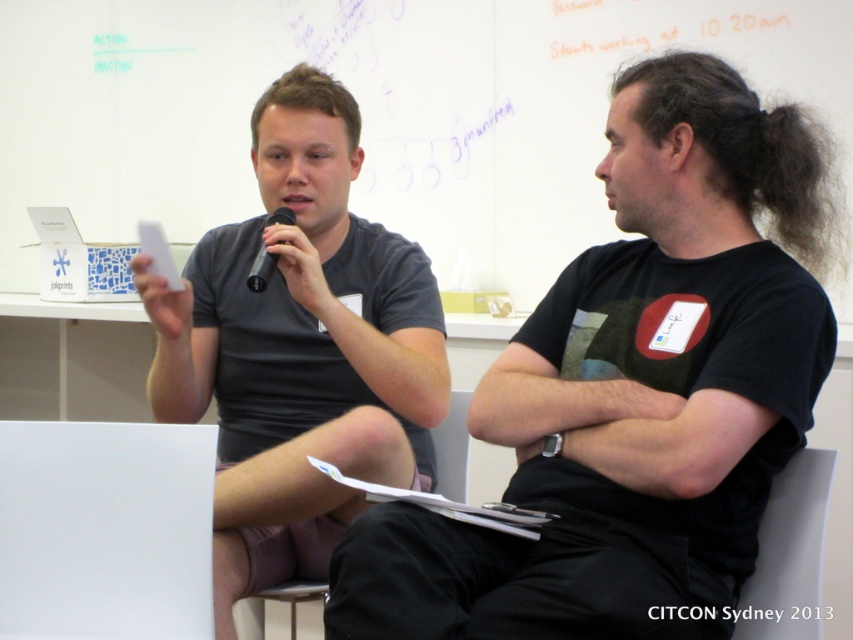
Is white paper at lower left further to the viewer compared to black plastic microphone at upper center?

That is False.

Between white paper at lower left and black plastic microphone at upper center, which one is positioned higher?

black plastic microphone at upper center is higher up.

Is point (137, 483) positioned behind point (259, 248)?

No, (137, 483) is in front of (259, 248).

Where is `white paper at lower left`? This screenshot has height=640, width=853. white paper at lower left is located at coordinates (105, 529).

Between black matte t-shirt at center and white paper at upper center, which one has more height?

black matte t-shirt at center

Between black matte t-shirt at center and white paper at upper center, which one has less height?

white paper at upper center

Is point (802, 244) closer to viewer compared to point (782, 611)?

No, (802, 244) is further to viewer.

Identify the location of black matte t-shirt at center. [x=634, y=388].

I want to click on black matte t-shirt at center, so click(x=634, y=388).

Which is more to the left, black matte t-shirt at center or matte gray t-shirt at center?

Positioned to the left is matte gray t-shirt at center.

This screenshot has height=640, width=853. Find the location of `black matte t-shirt at center`. black matte t-shirt at center is located at coordinates (634, 388).